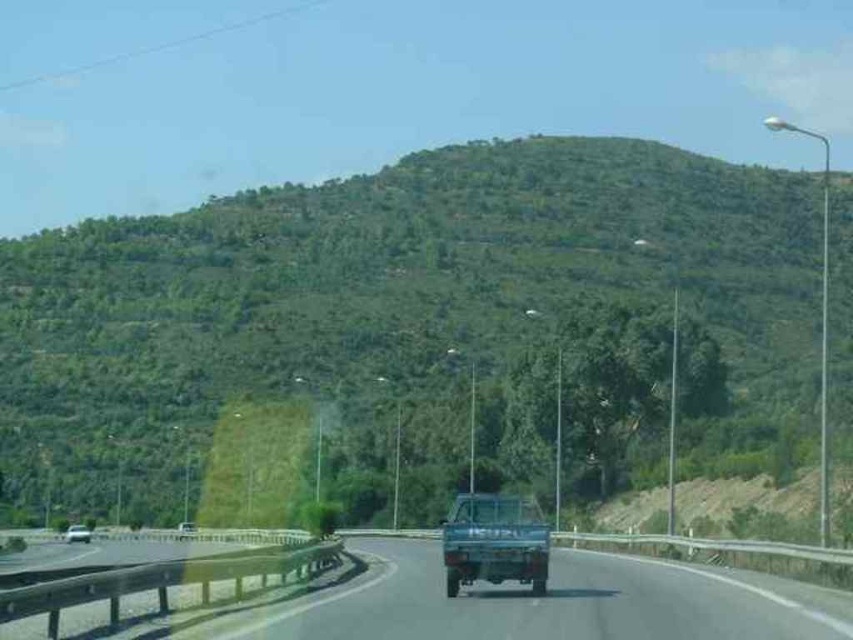
Based on the photo, can you confirm if green leafy hillside at center is shorter than metallic blue truck at center?

No, green leafy hillside at center is not shorter than metallic blue truck at center.

Which is more to the right, green leafy hillside at center or metallic blue truck at center?

green leafy hillside at center is more to the right.

Is point (802, 204) farther from camera compared to point (460, 513)?

Yes, point (802, 204) is behind point (460, 513).

Identify the location of green leafy hillside at center. (419, 323).

Which of these two, green leafy hillside at center or metallic silver car at lower left, stands taller?

Standing taller between the two is green leafy hillside at center.

Which is above, green leafy hillside at center or metallic silver car at lower left?

green leafy hillside at center

Describe the element at coordinates (419, 323) in the screenshot. I see `green leafy hillside at center` at that location.

You are a GUI agent. You are given a task and a screenshot of the screen. Output one action in this format:
    pyautogui.click(x=<x>, y=<y>)
    Task: Click on the green leafy hillside at center
    The height and width of the screenshot is (640, 853).
    Given the screenshot: What is the action you would take?
    pyautogui.click(x=419, y=323)

Identify the location of metallic blue truck at center. This screenshot has width=853, height=640. (494, 541).

Does point (503, 516) lie behind point (78, 536)?

No, (503, 516) is closer to viewer.

Find the location of a particular element. metallic blue truck at center is located at coordinates (494, 541).